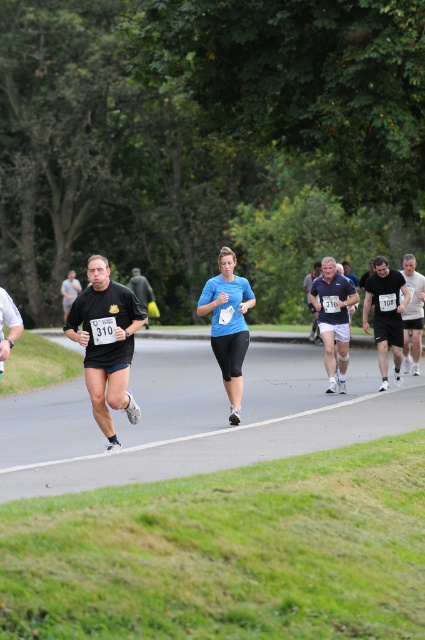
Question: Which point is closer to the camera taking this photo?

Choices:
 (A) (70, 285)
 (B) (136, 269)
 (C) (218, 352)

Answer: (C)

Question: Which object is closer to the camera taking this photo?

Choices:
 (A) white matte shirt at center
 (B) blue fabric shorts at center
 (C) black matte running shirt at center

Answer: (C)

Question: Is matte black shirt at center to the left of black matte running shirt at center from the viewer's perspective?

Choices:
 (A) no
 (B) yes

Answer: (A)

Question: From the image, what is the correct spatial relationship of black matte shorts at right in relation to dark blue t-shirt at center?

Choices:
 (A) left
 (B) right

Answer: (A)

Question: Which object is closer to the camera taking this photo?

Choices:
 (A) dark blue t-shirt at center
 (B) matte black shirt at center

Answer: (B)

Question: Is black matte shorts at right to the left of black matte t-shirt at center from the viewer's perspective?

Choices:
 (A) yes
 (B) no

Answer: (B)